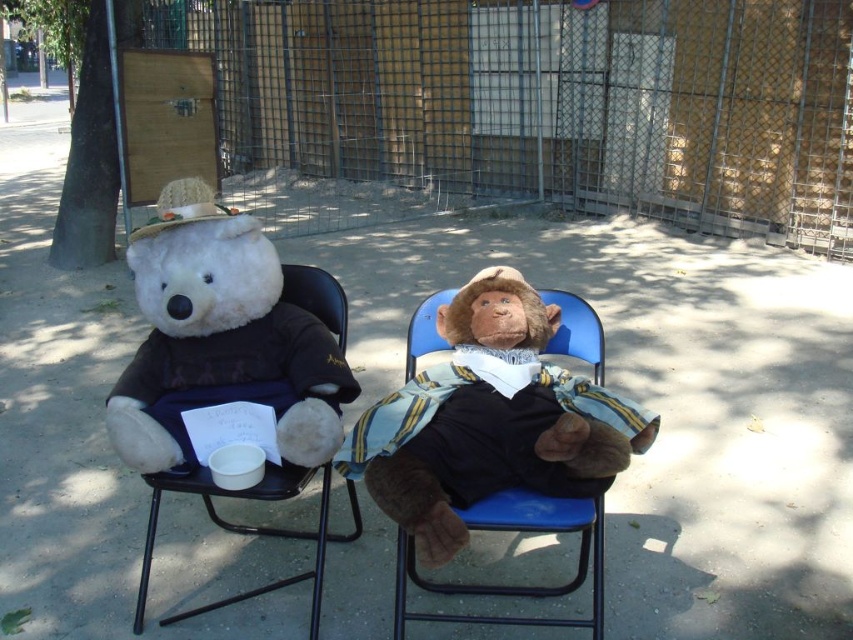
Question: Can you confirm if white plush bear at left is positioned below blue plastic chair at center?

Choices:
 (A) yes
 (B) no

Answer: (B)

Question: Does white plush bear at left appear on the right side of blue plastic chair at center?

Choices:
 (A) yes
 (B) no

Answer: (B)

Question: Which point is farther to the camera?

Choices:
 (A) (252, 301)
 (B) (560, 339)

Answer: (B)

Question: Can you confirm if blue plastic chair at center is positioned above black fabric chair at left?

Choices:
 (A) no
 (B) yes

Answer: (A)

Question: Which point is closer to the camera taking this photo?

Choices:
 (A) (549, 502)
 (B) (322, 541)

Answer: (A)

Question: Which of the following is the farthest from the observer?

Choices:
 (A) blue plastic chair at center
 (B) white plush bear at left
 (C) black fabric chair at left

Answer: (C)